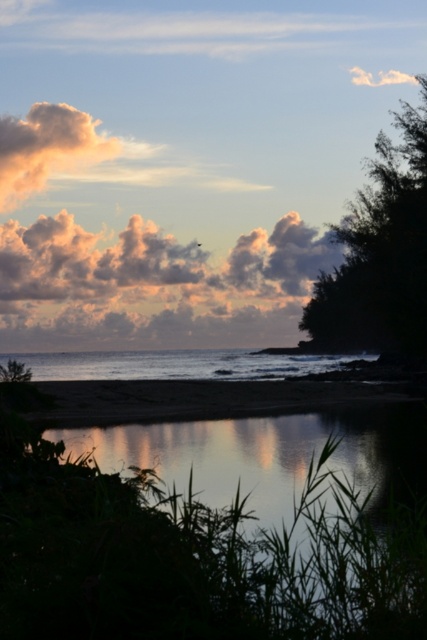
You are standing at the center of the image and want to walk to the sandy shore at lower center. Which direction should you move in?

The sandy shore at lower center is located at point 0.623 on the x axis and 0.433 on the y axis. Since you are at the center, you should move towards the lower center direction to reach it.

In the scene shown: You are standing on the beach looking at the coastal scene. You see the silvery reflective water at lower center and the cloudy cotton cloud at upper left. Which object is located to the right of the other?

The silvery reflective water at lower center is positioned on the right side of cloudy cotton cloud at upper left.

You are standing on the sandy shore at lower center and looking towards the cloudy cotton cloud at center. Which object is closer to you?

The sandy shore at lower center is closer to you since it is in front of the cloudy cotton cloud at center.